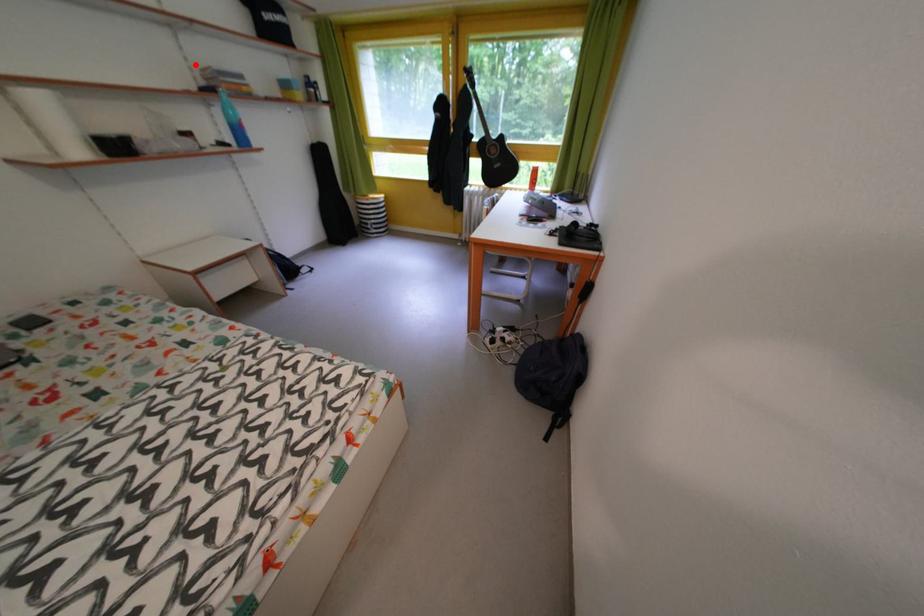
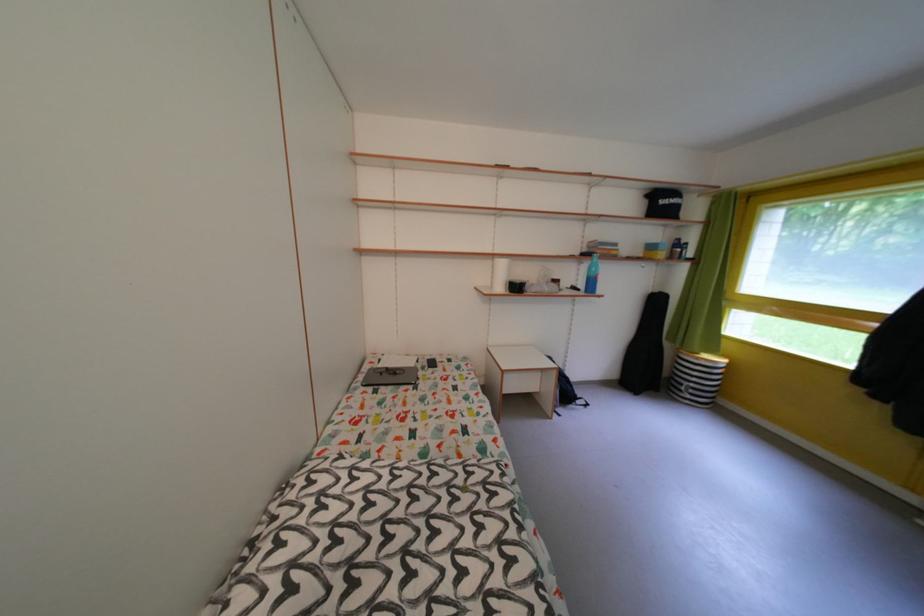
Question: I am providing you with two images of the same scene from different viewpoints. Image1 has a red point marked. In image2, the corresponding 3D location appears at what relative position? Reply with the corresponding letter.

Choices:
 (A) Closer
 (B) Farther

Answer: (A)